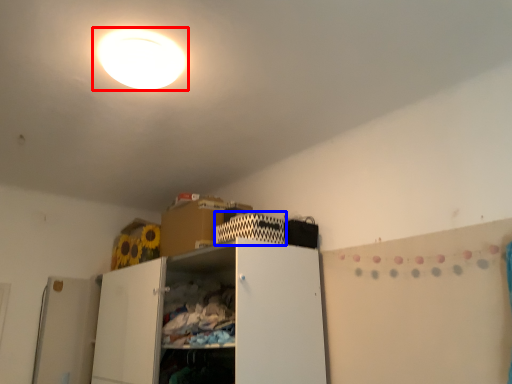
Question: Which object appears closest to the camera in this image, lamp (highlighted by a red box) or cabinet (highlighted by a blue box)?

Choices:
 (A) lamp
 (B) cabinet

Answer: (A)